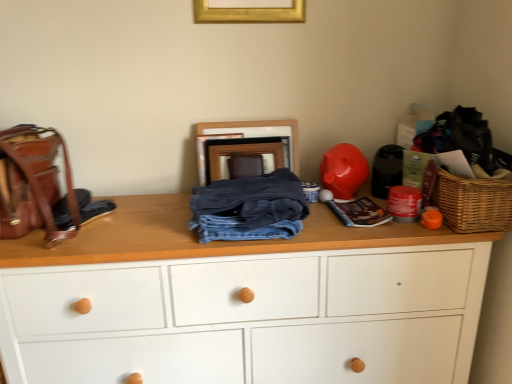
The image size is (512, 384). Describe the element at coordinates (240, 302) in the screenshot. I see `white painted wood chest of drawers at center` at that location.

Where is `leather backpack at left`? leather backpack at left is located at coordinates (41, 187).

Image resolution: width=512 pixels, height=384 pixels. Describe the element at coordinates (41, 187) in the screenshot. I see `leather backpack at left` at that location.

In order to face denim fabric pants at center, should I rotate leftwards or rightwards?

To align with it, rotate left about 1.009°.

Locate an element on the screen. This screenshot has height=384, width=512. wooden picture frame at center, the second picture frame viewed from the top is located at coordinates (257, 132).

Image resolution: width=512 pixels, height=384 pixels. In order to click on gold metallic picture frame at upper center, positioned as the 2th picture frame in bottom-to-top order in this screenshot , I will do `click(248, 13)`.

You are a GUI agent. You are given a task and a screenshot of the screen. Output one action in this format:
    pyautogui.click(x=<x>, y=<y>)
    Task: Click on the white painted wood chest of drawers at center
    
    Given the screenshot: What is the action you would take?
    pyautogui.click(x=240, y=302)

From the image's perspective, is shiny plastic piggy bank at right located beneath white painted wood chest of drawers at center?

No, from the image's perspective, shiny plastic piggy bank at right is not beneath white painted wood chest of drawers at center.

Which is in front, shiny plastic piggy bank at right or white painted wood chest of drawers at center?

Positioned in front is white painted wood chest of drawers at center.

Is shiny plastic piggy bank at right far away from white painted wood chest of drawers at center?

shiny plastic piggy bank at right is near white painted wood chest of drawers at center, not far away.

Is leather backpack at left situated inside wooden picture frame at center, placed as the second picture frame when sorted from front to back, or outside?

leather backpack at left is not enclosed by wooden picture frame at center, placed as the second picture frame when sorted from front to back.

Between leather backpack at left and wooden picture frame at center, the second picture frame viewed from the top, which one appears on the right side from the viewer's perspective?

wooden picture frame at center, the second picture frame viewed from the top.

From a real-world perspective, who is located higher, leather backpack at left or wooden picture frame at center, the second picture frame viewed from the top?

wooden picture frame at center, the second picture frame viewed from the top, is physically above.

Is wooden picture frame at center, the second picture frame viewed from the top, at the back of leather backpack at left?

That's not correct — leather backpack at left is not looking away from wooden picture frame at center, the second picture frame viewed from the top.

How different are the orientations of gold metallic picture frame at upper center, positioned as the 2th picture frame in bottom-to-top order, and woven brown picnic basket at right in degrees?

The angular difference between gold metallic picture frame at upper center, positioned as the 2th picture frame in bottom-to-top order, and woven brown picnic basket at right is 90.3 degrees.

Is gold metallic picture frame at upper center, acting as the 1th picture frame starting from the top, positioned far away from woven brown picnic basket at right?

No.

Is gold metallic picture frame at upper center, positioned as the 2th picture frame in bottom-to-top order, smaller than woven brown picnic basket at right?

Correct, gold metallic picture frame at upper center, positioned as the 2th picture frame in bottom-to-top order, occupies less space than woven brown picnic basket at right.

Is point (214, 11) closer or farther from the camera than point (489, 230)?

Point (214, 11) is farther from the camera than point (489, 230).

Considering the relative sizes of leather backpack at left and white painted wood chest of drawers at center in the image provided, is leather backpack at left smaller than white painted wood chest of drawers at center?

Correct, leather backpack at left occupies less space than white painted wood chest of drawers at center.

From the image's perspective, would you say leather backpack at left is shown under white painted wood chest of drawers at center?

Actually, leather backpack at left appears above white painted wood chest of drawers at center in the image.

Is point (40, 216) farther from camera compared to point (364, 238)?

Yes, it is.

Is leather backpack at left to the right of white painted wood chest of drawers at center from the viewer's perspective?

No, leather backpack at left is not to the right of white painted wood chest of drawers at center.

Is gold metallic picture frame at upper center, positioned as the 2th picture frame in bottom-to-top order, completely or partially inside denim fabric pants at center?

No, denim fabric pants at center does not contain gold metallic picture frame at upper center, positioned as the 2th picture frame in bottom-to-top order.

What's the angular difference between denim fabric pants at center and gold metallic picture frame at upper center, positioned as the 2th picture frame in bottom-to-top order,'s facing directions?

The facing directions of denim fabric pants at center and gold metallic picture frame at upper center, positioned as the 2th picture frame in bottom-to-top order, are 2.15 degrees apart.

From the picture: Is denim fabric pants at center closer to the viewer compared to gold metallic picture frame at upper center, positioned as the 2th picture frame in bottom-to-top order?

Yes, it is in front of gold metallic picture frame at upper center, positioned as the 2th picture frame in bottom-to-top order.

From the image's perspective, who appears lower, denim fabric pants at center or gold metallic picture frame at upper center, which appears as the first picture frame when viewed from the front?

denim fabric pants at center.

From the image's perspective, which one is positioned higher, white painted wood chest of drawers at center or leather backpack at left?

leather backpack at left, from the image's perspective.

From a real-world perspective, is white painted wood chest of drawers at center on top of leather backpack at left?

Incorrect, from a real-world perspective, white painted wood chest of drawers at center is lower than leather backpack at left.

Could you tell me if white painted wood chest of drawers at center is facing leather backpack at left?

No.

Is leather backpack at left in contact with denim fabric pants at center?

No, leather backpack at left is not making contact with denim fabric pants at center.

From the image's perspective, relative to denim fabric pants at center, is leather backpack at left above or below?

leather backpack at left is situated higher than denim fabric pants at center in the image.

Can we say leather backpack at left lies outside denim fabric pants at center?

Yes, leather backpack at left is not within denim fabric pants at center.

Is point (48, 202) farther from viewer compared to point (258, 176)?

No, (48, 202) is closer to viewer.

Identify the location of toy behind the white painted wood chest of drawers at center. (344, 171).

The image size is (512, 384). What are the coordinates of `handbag on the left side of wooden picture frame at center, the 1th picture frame from the bottom` in the screenshot? It's located at (41, 187).

Based on their spatial positions, is shiny plastic piggy bank at right or gold metallic picture frame at upper center, acting as the 1th picture frame starting from the top, further from denim fabric pants at center?

Based on the image, gold metallic picture frame at upper center, acting as the 1th picture frame starting from the top, appears to be further to denim fabric pants at center.

From the picture: From the image, which object appears to be farther from leather backpack at left, wooden picture frame at center, placed as the second picture frame when sorted from front to back, or white painted wood chest of drawers at center?

wooden picture frame at center, placed as the second picture frame when sorted from front to back, is positioned further to the anchor leather backpack at left.

Looking at the image, which one is located further to gold metallic picture frame at upper center, positioned as the 2th picture frame in bottom-to-top order, wooden picture frame at center, the 1th picture frame from the bottom, or denim fabric pants at center?

denim fabric pants at center is positioned further to the anchor gold metallic picture frame at upper center, positioned as the 2th picture frame in bottom-to-top order.

Which object lies nearer to the anchor point shiny plastic piggy bank at right, gold metallic picture frame at upper center, positioned as the 2th picture frame in bottom-to-top order, or woven brown picnic basket at right?

woven brown picnic basket at right is positioned closer to the anchor shiny plastic piggy bank at right.

From the image, which object appears to be nearer to wooden picture frame at center, the 1th picture frame from the bottom, woven brown picnic basket at right or leather backpack at left?

leather backpack at left is positioned closer to the anchor wooden picture frame at center, the 1th picture frame from the bottom.

Which object lies nearer to the anchor point wooden picture frame at center, placed as the second picture frame when sorted from front to back, white painted wood chest of drawers at center or woven brown picnic basket at right?

Based on the image, white painted wood chest of drawers at center appears to be nearer to wooden picture frame at center, placed as the second picture frame when sorted from front to back.

Which object lies further to the anchor point white painted wood chest of drawers at center, shiny plastic piggy bank at right or leather backpack at left?

The object further to white painted wood chest of drawers at center is shiny plastic piggy bank at right.

Based on their spatial positions, is shiny plastic piggy bank at right or wooden picture frame at center, the 1th picture frame from the bottom, further from white painted wood chest of drawers at center?

A: Among the two, wooden picture frame at center, the 1th picture frame from the bottom, is located further to white painted wood chest of drawers at center.

Locate an element on the screen. clothing between wooden picture frame at center, the 1th picture frame from the bottom, and shiny plastic piggy bank at right is located at coordinates (249, 208).

The height and width of the screenshot is (384, 512). I want to click on the chest of drawers situated between leather backpack at left and woven brown picnic basket at right from left to right, so click(240, 302).

This screenshot has height=384, width=512. In order to click on toy that lies between gold metallic picture frame at upper center, acting as the 1th picture frame starting from the top, and denim fabric pants at center from top to bottom in this screenshot , I will do `click(344, 171)`.

Locate an element on the screen. The width and height of the screenshot is (512, 384). clothing between gold metallic picture frame at upper center, acting as the 1th picture frame starting from the top, and white painted wood chest of drawers at center from top to bottom is located at coordinates (249, 208).